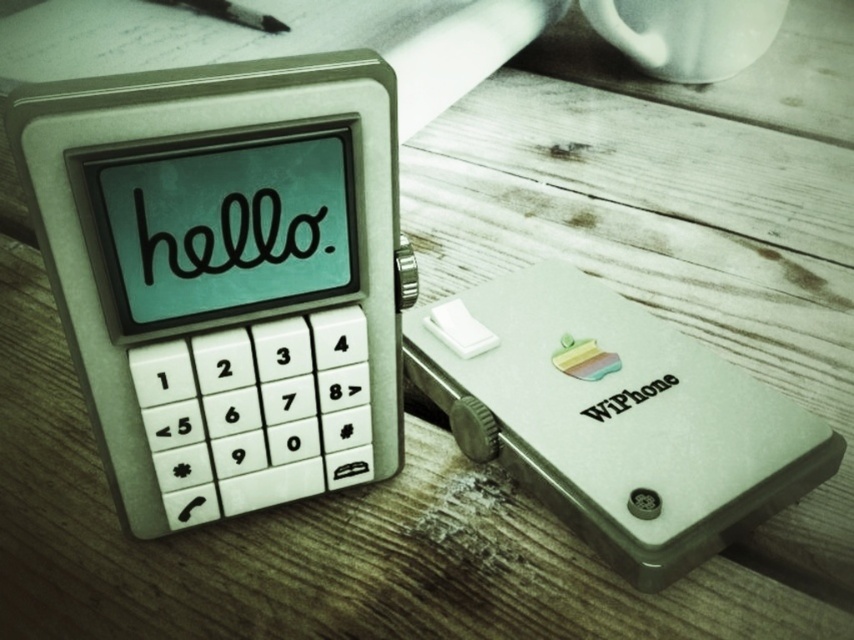
Consider the image. Is matte white phone at center positioned in front of white ceramic mug at upper center?

Yes, it is in front of white ceramic mug at upper center.

Does matte white phone at center have a greater width compared to white ceramic mug at upper center?

No.

This screenshot has width=854, height=640. What do you see at coordinates (224, 275) in the screenshot? I see `matte white phone at center` at bounding box center [224, 275].

This screenshot has height=640, width=854. I want to click on matte white phone at center, so click(x=224, y=275).

Between white ceramic mug at upper center and brushed metal pen at upper left, which one has less height?

With less height is brushed metal pen at upper left.

Is white ceramic mug at upper center above brushed metal pen at upper left?

Incorrect, white ceramic mug at upper center is not positioned above brushed metal pen at upper left.

Is point (706, 12) behind point (235, 17)?

No, (706, 12) is in front of (235, 17).

Locate an element on the screen. Image resolution: width=854 pixels, height=640 pixels. white ceramic mug at upper center is located at coordinates (687, 33).

Which of these two, matte white phone at center or brushed metal pen at upper left, stands shorter?

brushed metal pen at upper left

Looking at this image, is matte white phone at center bigger than brushed metal pen at upper left?

Correct, matte white phone at center is larger in size than brushed metal pen at upper left.

What are the coordinates of `matte white phone at center` in the screenshot? It's located at (224, 275).